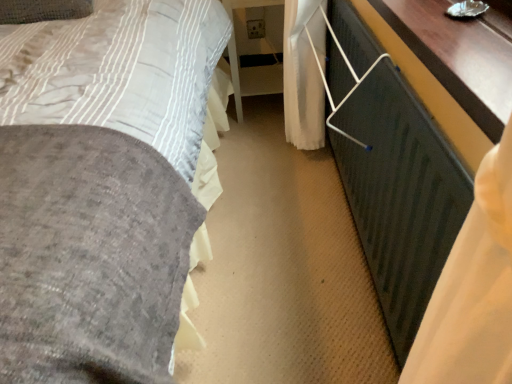
Locate an element on the screen. vacant space situated on the left part of metallic silver balustrade at lower right is located at coordinates (272, 251).